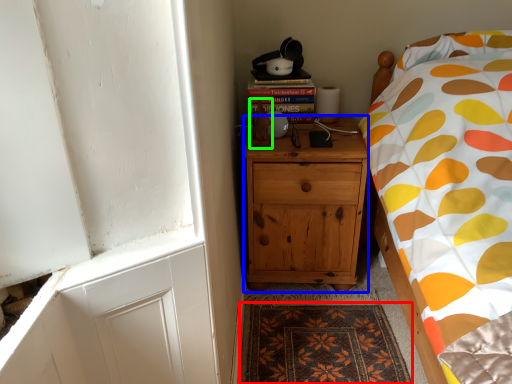
Question: Based on their relative distances, which object is nearer to mat (highlighted by a red box)? Choose from cabinetry (highlighted by a blue box) and toy (highlighted by a green box).

Choices:
 (A) cabinetry
 (B) toy

Answer: (A)